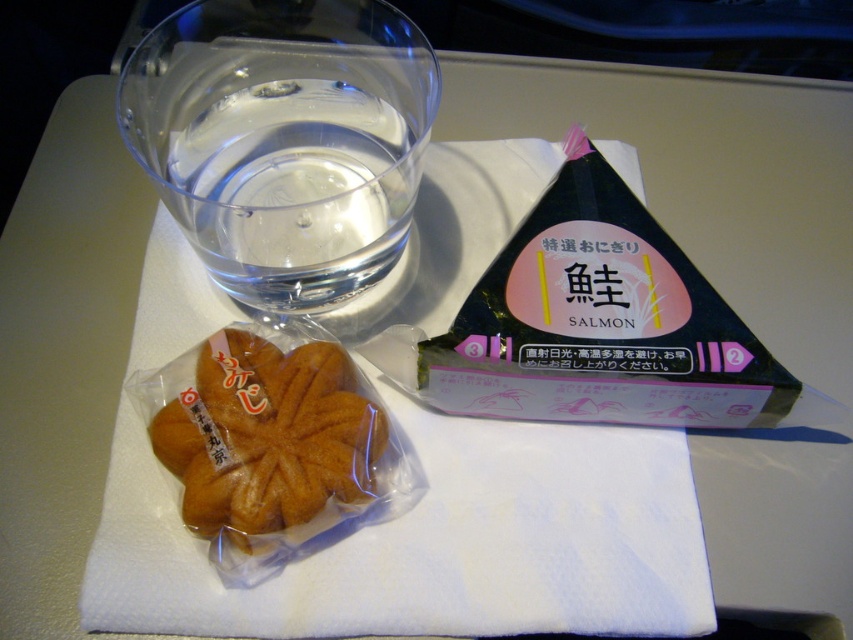
You are a flight attendant checking the meal tray. The airline requires that all items on the tray must be within 20 inches from the camera to ensure proper scanning. Is the black paper triangle at upper right within the required distance?

The black paper triangle at upper right is 20.35 inches away from the camera, which exceeds the 20 inches requirement. Therefore, it is outside the required distance for proper scanning.

You are a flight attendant checking the meal tray. The black paper triangle at upper right has specific coordinates. Can you confirm if it is positioned at the center of the tray?

The black paper triangle at upper right is located at point (601, 323), which is near the center of the tray since the coordinates are close to 0.5 in both x and y axes.

You are a flight attendant preparing to serve a meal. You need to place a napkin between the black paper triangle at upper right and the golden brown pastry at center. Which object should you place the napkin below?

The golden brown pastry at center should be placed below the napkin because the black paper triangle at upper right is above it.